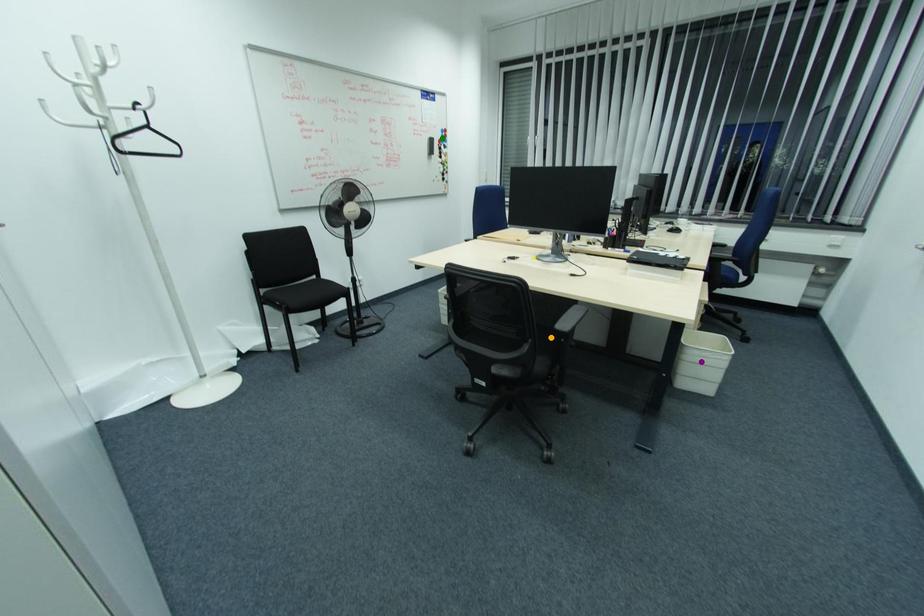
Order these from farthest to nearest:
- orange point
- purple point
- green point

green point → purple point → orange point